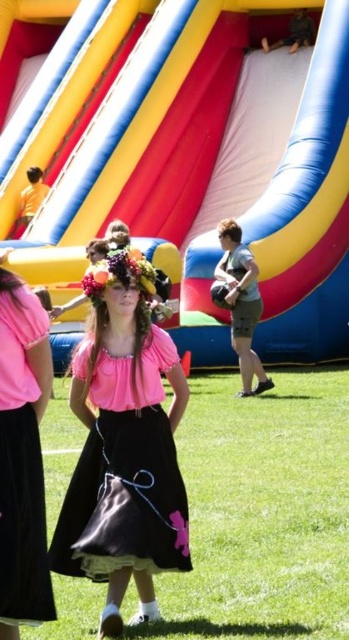
Question: Which object is closer to the camera taking this photo?

Choices:
 (A) green grass at center
 (B) rubber inflatable slide at center
 (C) black satin dress at center
 (D) pink satin dress at center

Answer: (C)

Question: Does rubber inflatable slide at center have a smaller size compared to pink satin dress at center?

Choices:
 (A) yes
 (B) no

Answer: (B)

Question: Estimate the real-world distances between objects in this image. Which object is closer to the black satin dress at center?

Choices:
 (A) pink satin dress at center
 (B) green grass at center

Answer: (A)

Question: Can you confirm if rubber inflatable slide at center is bigger than pink satin dress at center?

Choices:
 (A) no
 (B) yes

Answer: (B)

Question: Can you confirm if rubber inflatable slide at center is smaller than pink satin dress at center?

Choices:
 (A) yes
 (B) no

Answer: (B)

Question: Which object appears closest to the camera in this image?

Choices:
 (A) green grass at center
 (B) black satin dress at center
 (C) rubber inflatable slide at center
 (D) pink satin dress at center

Answer: (B)